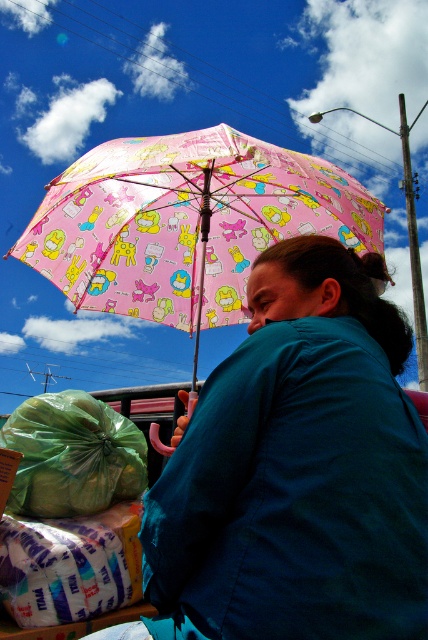
In the scene shown: Is teal fabric shirt at center bigger than pink fabric umbrella at upper center?

No, teal fabric shirt at center is not bigger than pink fabric umbrella at upper center.

Can you confirm if teal fabric shirt at center is positioned above pink fabric umbrella at upper center?

No, teal fabric shirt at center is not above pink fabric umbrella at upper center.

The width and height of the screenshot is (428, 640). What do you see at coordinates (297, 468) in the screenshot?
I see `teal fabric shirt at center` at bounding box center [297, 468].

Image resolution: width=428 pixels, height=640 pixels. I want to click on teal fabric shirt at center, so click(x=297, y=468).

Does pink fabric umbrella at upper center appear on the left side of green plastic bag at lower left?

Incorrect, pink fabric umbrella at upper center is not on the left side of green plastic bag at lower left.

Does pink fabric umbrella at upper center have a lesser width compared to green plastic bag at lower left?

No, pink fabric umbrella at upper center is not thinner than green plastic bag at lower left.

Is point (112, 307) behind point (103, 428)?

That is True.

Locate an element on the screen. pink fabric umbrella at upper center is located at coordinates (186, 221).

Describe the element at coordinates (297, 468) in the screenshot. The width and height of the screenshot is (428, 640). I see `teal fabric shirt at center` at that location.

Find the location of `teal fabric shirt at center`. teal fabric shirt at center is located at coordinates (297, 468).